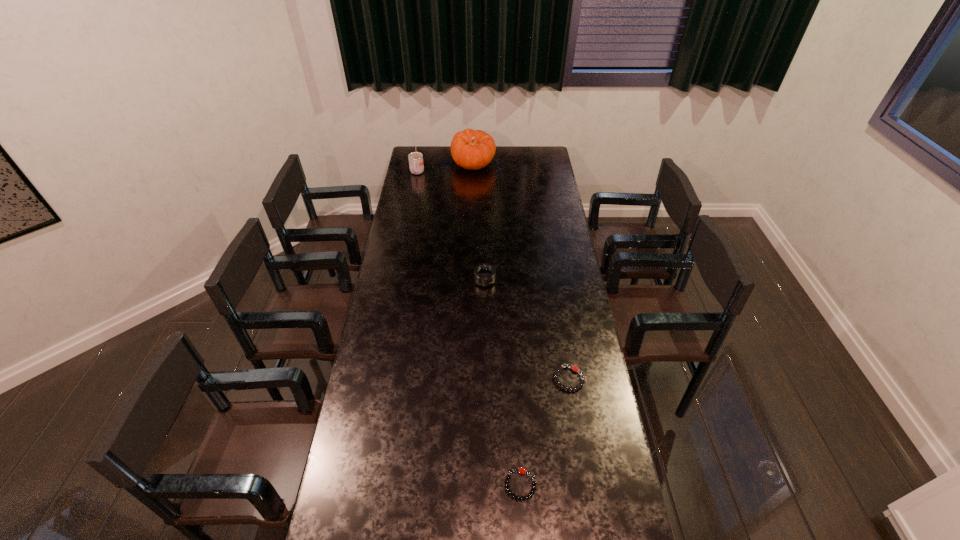
What are the coordinates of `vacant space located on the side with the handle of the leftmost object` in the screenshot? It's located at (413, 193).

The image size is (960, 540). Find the location of `free location located 0.270m on the side of the telephoto lens with brand markings and control switches`. free location located 0.270m on the side of the telephoto lens with brand markings and control switches is located at coordinates (486, 338).

I want to click on free space located 0.240m on the back of the farther bracelet, so [559, 316].

Find the location of `vacant area situated 0.090m on the front of the shorter bracelet`. vacant area situated 0.090m on the front of the shorter bracelet is located at coordinates (523, 536).

Locate an element on the screen. The height and width of the screenshot is (540, 960). object that is positioned at the far edge is located at coordinates (472, 150).

This screenshot has width=960, height=540. What are the coordinates of `object present at the left edge` in the screenshot? It's located at (416, 166).

Identify the location of object positioned at the right edge. (560, 368).

Find the location of a particular element. The width and height of the screenshot is (960, 540). free space at the far edge is located at coordinates (499, 157).

Locate an element on the screen. The width and height of the screenshot is (960, 540). free space at the left edge is located at coordinates (372, 523).

Locate an element on the screen. This screenshot has width=960, height=540. vacant space at the right edge of the desktop is located at coordinates (538, 213).